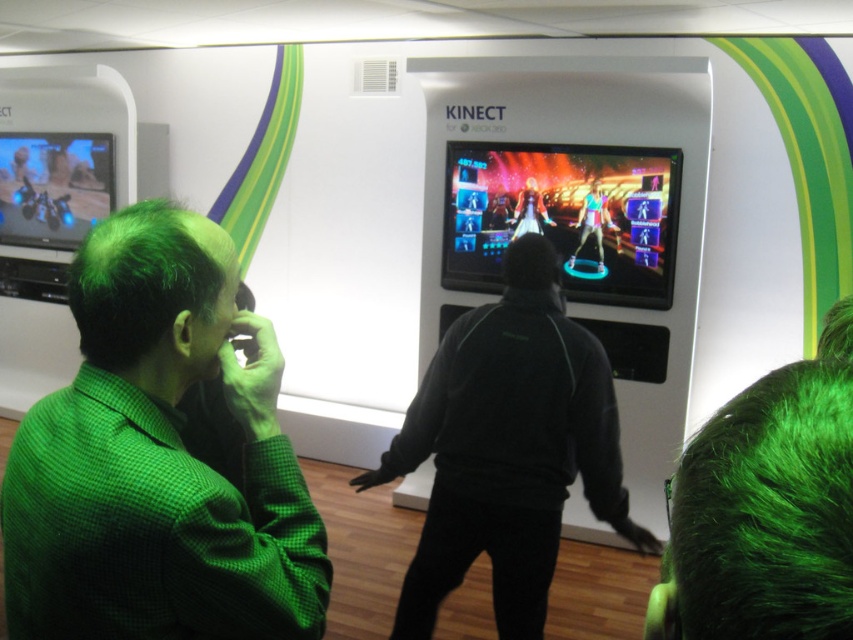
Is shiny plastic screen at center shorter than shiny silver figure at center?

Incorrect, shiny plastic screen at center's height does not fall short of shiny silver figure at center's.

Between point (479, 148) and point (538, 212), which one is positioned in front?

Point (538, 212)

Between point (480, 284) and point (546, 216), which one is positioned in front?

Point (546, 216)

This screenshot has width=853, height=640. I want to click on shiny plastic screen at center, so click(x=564, y=216).

Is green checkered shirt at left below black matte jacket at center?

Incorrect, green checkered shirt at left is not positioned below black matte jacket at center.

Is green checkered shirt at left bigger than black matte jacket at center?

No.

At what (x,y) coordinates should I click in order to perform the action: click on green checkered shirt at left. Please return your answer as a coordinate pair (x, y). Image resolution: width=853 pixels, height=640 pixels. Looking at the image, I should click on (158, 460).

Is green checkered shirt at left to the right of shiny silver figure at center from the viewer's perspective?

Incorrect, green checkered shirt at left is not on the right side of shiny silver figure at center.

Is green checkered shirt at left in front of shiny silver figure at center?

Yes, it is.

You are a GUI agent. You are given a task and a screenshot of the screen. Output one action in this format:
    pyautogui.click(x=<x>, y=<y>)
    Task: Click on the green checkered shirt at left
    
    Given the screenshot: What is the action you would take?
    pyautogui.click(x=158, y=460)